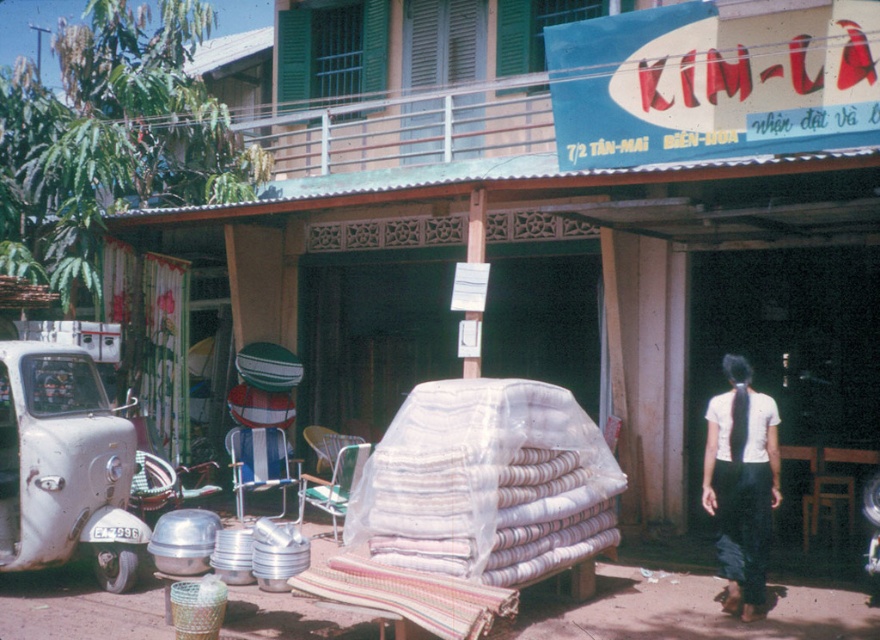
Looking at this image, you are a delivery person who needs to place a large package in the area near the white matte car at left and the white cotton shirt at center. Which object should you place the package next to to ensure it fits without overlapping?

The white matte car at left is bigger than the white cotton shirt at center, so placing the package next to the white matte car at left would provide more space and prevent overlapping.

Please provide the coordinates of the white woven blanket at center in the image. The coordinates should be in the format of a point with two decimal places, like point (486, 483). The scene is a street in front of a shop named Kim La, with items like rolled fabric, metallic containers, and chairs arranged outside. You see the white woven blanket at center. What are its coordinates?

The white woven blanket at center is located at point (486, 483).

You are a customer at the shop and want to buy both the white woven blanket at center and the white cotton shirt at center. Which item would you need a bigger bag to carry?

The white woven blanket at center has a larger size compared to the white cotton shirt at center, so you would need a bigger bag for the white woven blanket at center.